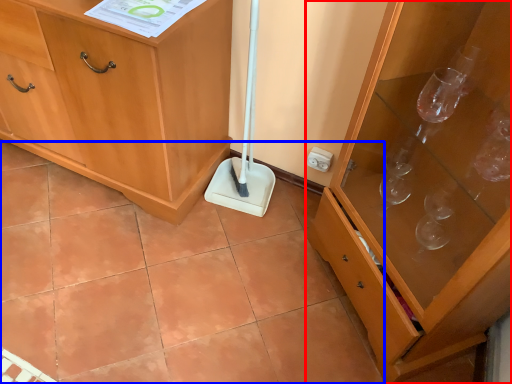
Question: Which object appears farthest to the camera in this image, cabinetry (highlighted by a red box) or ceramic tile (highlighted by a blue box)?

Choices:
 (A) cabinetry
 (B) ceramic tile

Answer: (B)